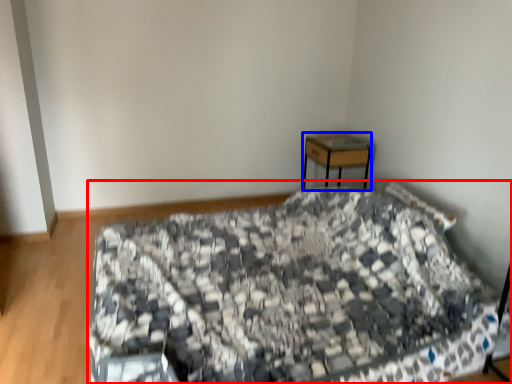
Question: Which of the following is the farthest to the observer, bed (highlighted by a red box) or desk (highlighted by a blue box)?

Choices:
 (A) bed
 (B) desk

Answer: (B)